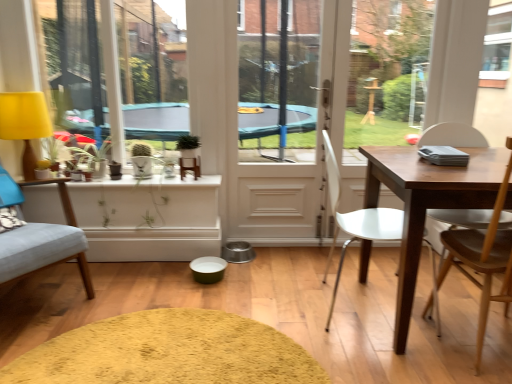
Where is `free space in front of white plastic chair at center, the 2th chair when ordered from right to left`? free space in front of white plastic chair at center, the 2th chair when ordered from right to left is located at coordinates (372, 355).